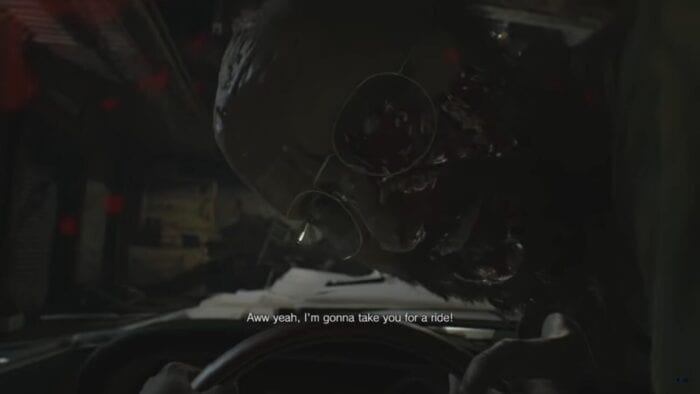
This screenshot has width=700, height=394. I want to click on papers, so click(x=348, y=300).